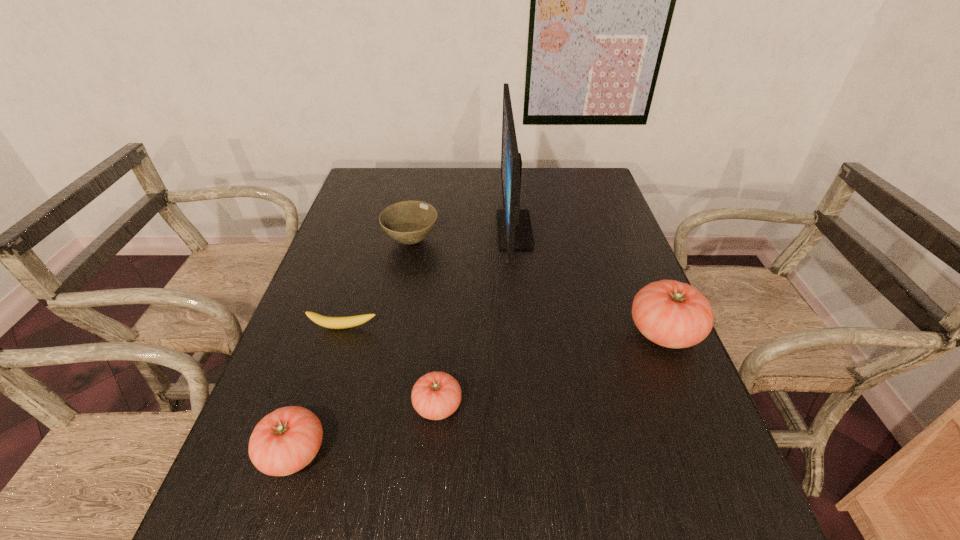
Please point a space for a new tomato to maintain equal intervals. Please provide its 2D coordinates. Your answer should be formatted as a tuple, i.e. [(x, y)], where the tuple contains the x and y coordinates of a point satisfying the conditions above.

[(560, 366)]